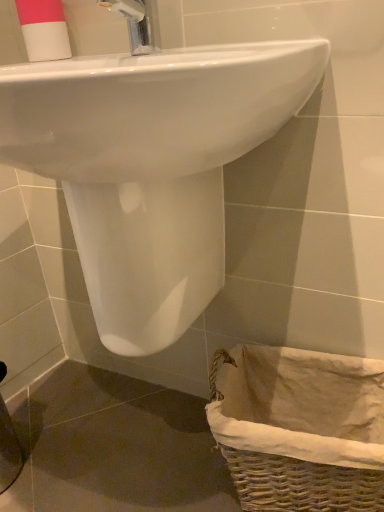
Question: Is white glossy sink at upper center surrounding woven wicker basket at lower right?

Choices:
 (A) yes
 (B) no

Answer: (B)

Question: Does white glossy sink at upper center have a larger size compared to woven wicker basket at lower right?

Choices:
 (A) no
 (B) yes

Answer: (B)

Question: From a real-world perspective, does white glossy sink at upper center sit lower than woven wicker basket at lower right?

Choices:
 (A) yes
 (B) no

Answer: (B)

Question: Considering the relative sizes of white glossy sink at upper center and woven wicker basket at lower right in the image provided, is white glossy sink at upper center smaller than woven wicker basket at lower right?

Choices:
 (A) no
 (B) yes

Answer: (A)

Question: Can you confirm if white glossy sink at upper center is shorter than woven wicker basket at lower right?

Choices:
 (A) yes
 (B) no

Answer: (B)

Question: Is white glossy sink at upper center not close to woven wicker basket at lower right?

Choices:
 (A) no
 (B) yes

Answer: (A)

Question: Are pink matte cup at upper left and woven wicker basket at lower right located far from each other?

Choices:
 (A) no
 (B) yes

Answer: (A)

Question: Is pink matte cup at upper left oriented towards woven wicker basket at lower right?

Choices:
 (A) yes
 (B) no

Answer: (B)

Question: Are pink matte cup at upper left and woven wicker basket at lower right making contact?

Choices:
 (A) no
 (B) yes

Answer: (A)

Question: Can you confirm if pink matte cup at upper left is thinner than woven wicker basket at lower right?

Choices:
 (A) no
 (B) yes

Answer: (B)

Question: Can you confirm if pink matte cup at upper left is positioned to the right of woven wicker basket at lower right?

Choices:
 (A) no
 (B) yes

Answer: (A)

Question: Is pink matte cup at upper left at the left side of woven wicker basket at lower right?

Choices:
 (A) yes
 (B) no

Answer: (A)

Question: From a real-world perspective, is woven wicker basket at lower right below white glossy sink at upper center?

Choices:
 (A) yes
 (B) no

Answer: (A)